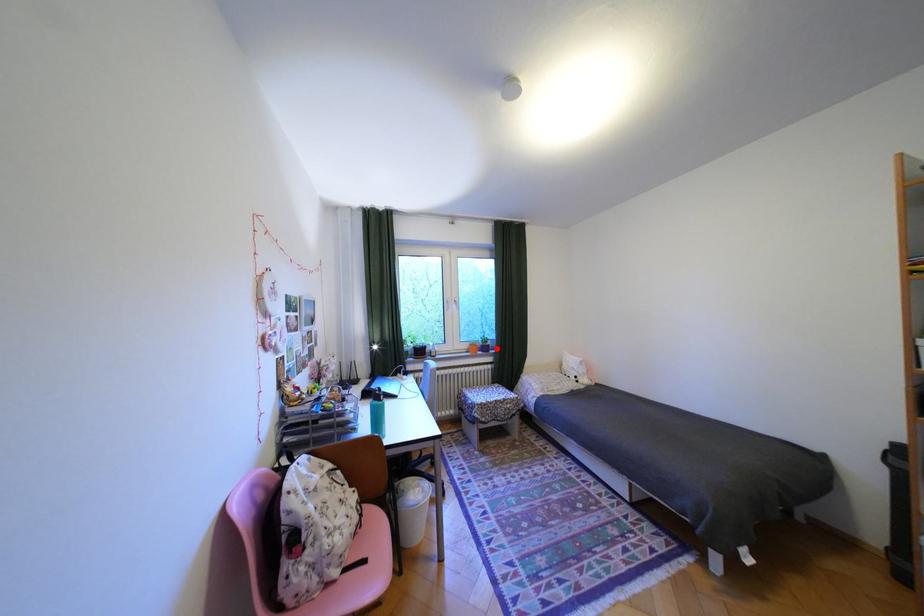
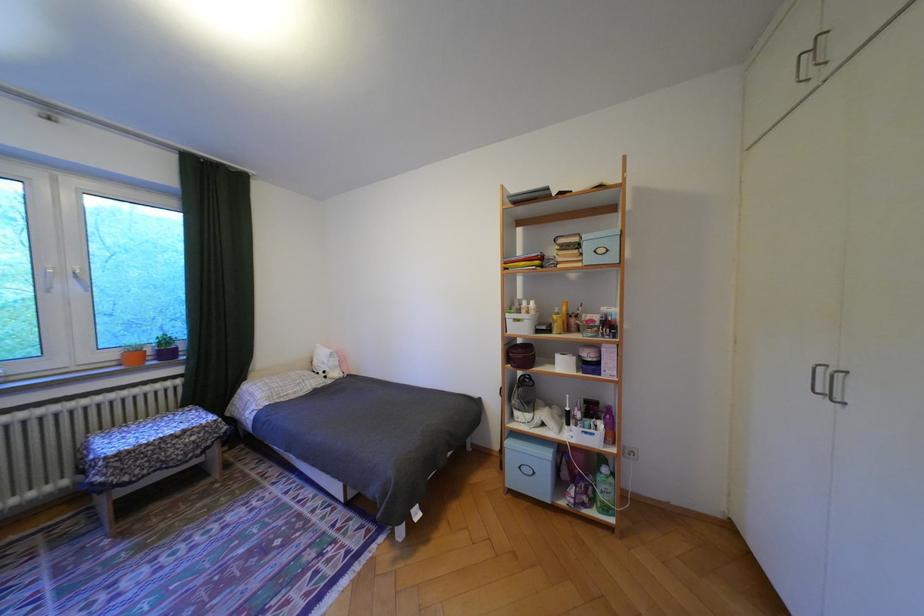
The point at the highlighted location is marked in the first image. Where is the corresponding point in the second image?

(178, 354)